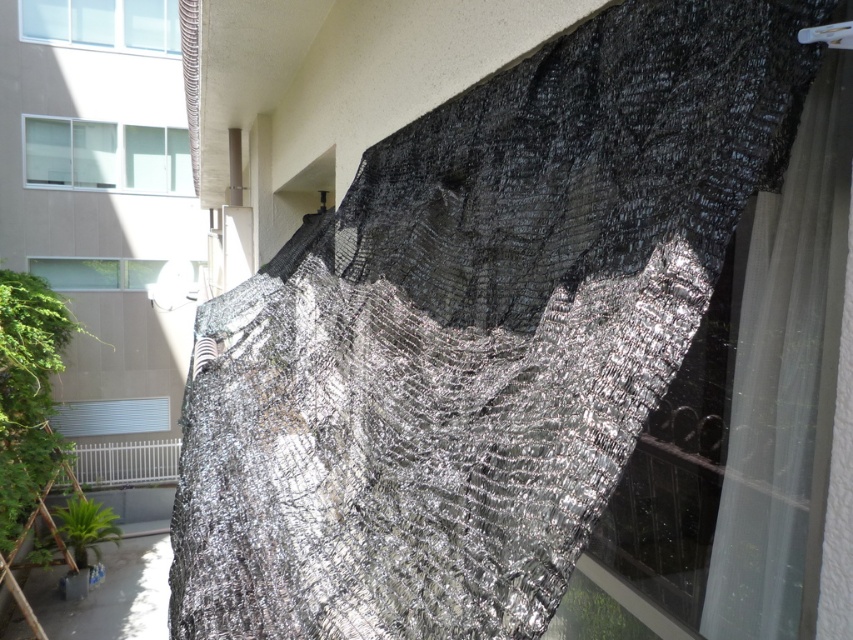
Question: Which of these objects is positioned farthest from the clear glass window at upper left?

Choices:
 (A) matte gray window at upper left
 (B) transparent glass window at upper left
 (C) black mesh curtain at upper left

Answer: (C)

Question: Which is nearer to the matte gray window at upper left?

Choices:
 (A) black mesh curtain at upper left
 (B) metallic mesh at upper right

Answer: (A)

Question: Considering the relative positions of matte gray window at upper left and black mesh curtain at upper left in the image provided, where is matte gray window at upper left located with respect to black mesh curtain at upper left?

Choices:
 (A) right
 (B) left

Answer: (B)

Question: Can you confirm if white sheer curtain at upper right is wider than metallic mesh at upper right?

Choices:
 (A) yes
 (B) no

Answer: (A)

Question: Does transparent glass window at upper left appear on the left side of matte gray window at upper left?

Choices:
 (A) yes
 (B) no

Answer: (B)

Question: Estimate the real-world distances between objects in this image. Which object is farther from the transparent glass window at upper left?

Choices:
 (A) black mesh curtain at upper left
 (B) matte gray window at upper left
 (C) white sheer curtain at upper right
 (D) metallic mesh at upper right

Answer: (D)